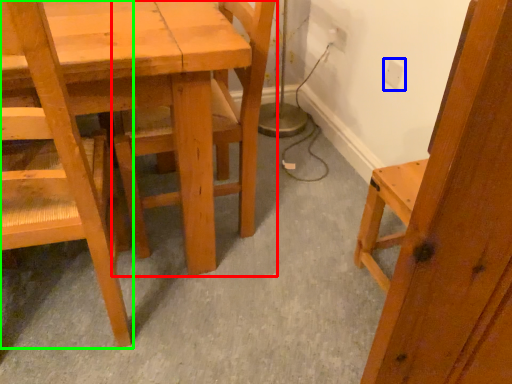
Question: Which object is positioned farthest from chair (highlighted by a red box)? Select from electric outlet (highlighted by a blue box) and chair (highlighted by a green box).

Choices:
 (A) electric outlet
 (B) chair

Answer: (A)